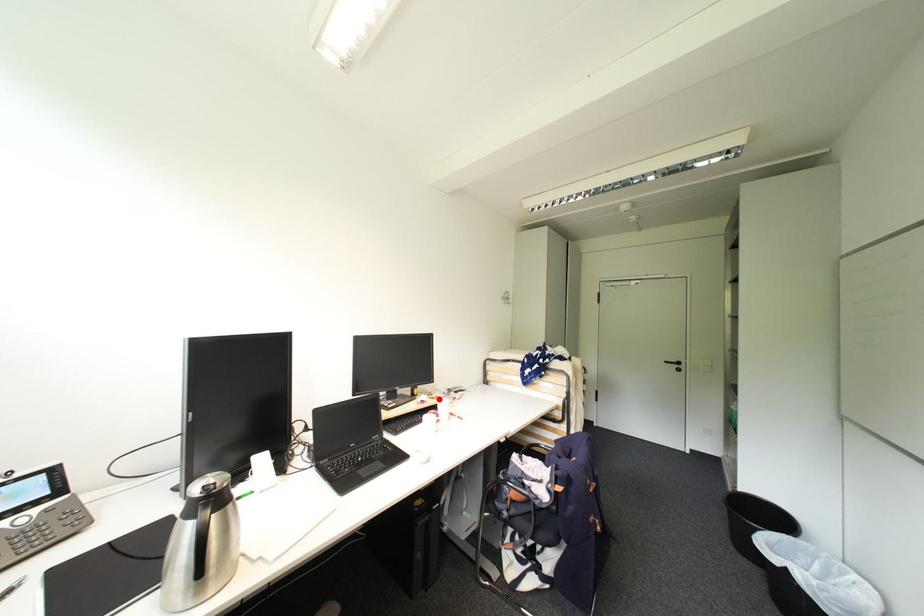
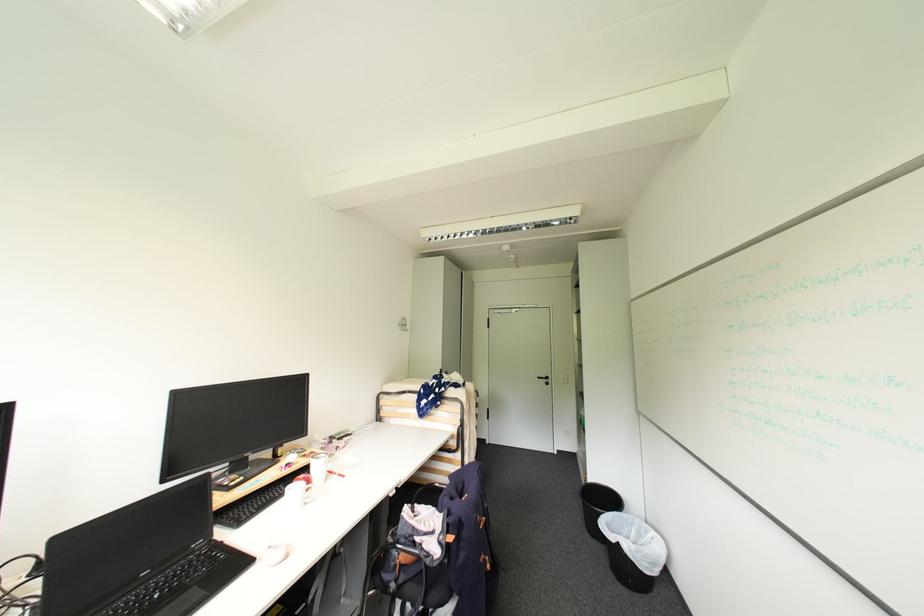
Locate, in the second image, the point that corresponds to the highlighted location in the first image.

(311, 456)